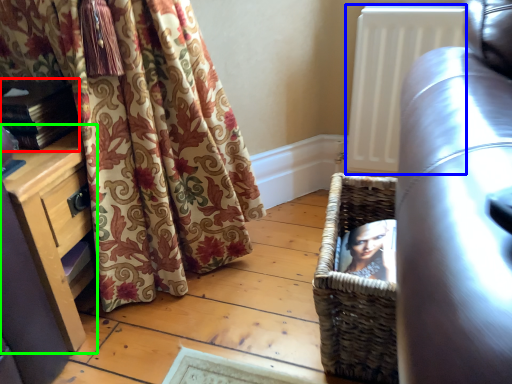
Question: Which is nearer to the book (highlighted by a red box)? radiator (highlighted by a blue box) or dresser (highlighted by a green box).

Choices:
 (A) radiator
 (B) dresser

Answer: (B)